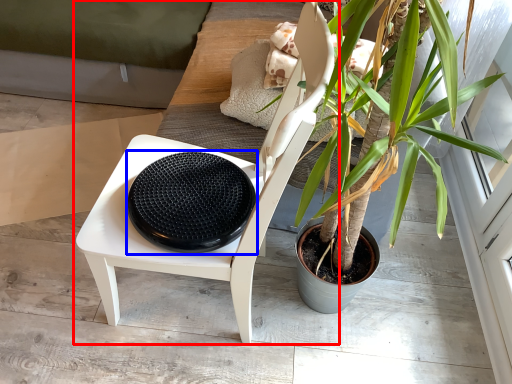
Question: Which of the following is the closest to the observer, chair (highlighted by a red box) or footrest (highlighted by a blue box)?

Choices:
 (A) chair
 (B) footrest

Answer: (A)